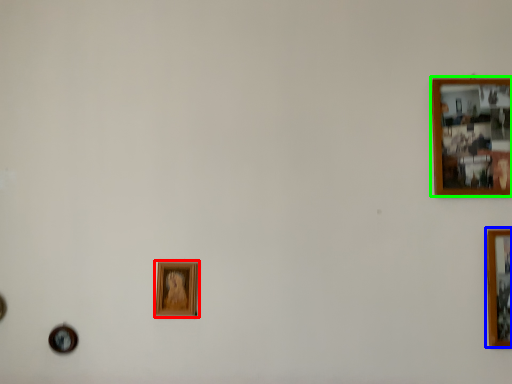
Question: Which object is positioned closest to picture frame (highlighted by a red box)? Select from picture frame (highlighted by a blue box) and picture frame (highlighted by a green box).

Choices:
 (A) picture frame
 (B) picture frame

Answer: (B)